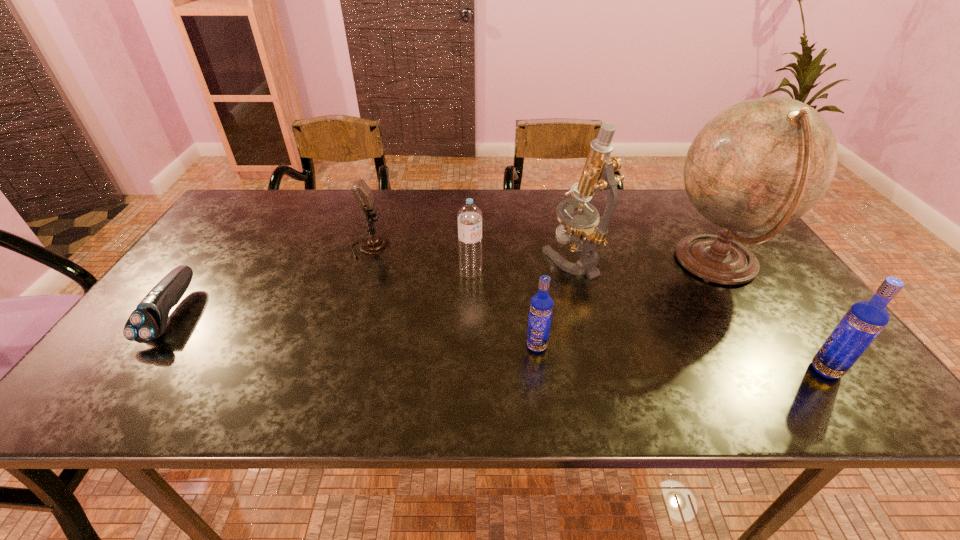
What are the coordinates of `object that is the fifth closest to the fifth object from right to left` in the screenshot? It's located at (148, 321).

Choose which object is the second nearest neighbor to the second object from left to right. Please provide its 2D coordinates. Your answer should be formatted as a tuple, i.e. [(x, y)], where the tuple contains the x and y coordinates of a point satisfying the conditions above.

[(148, 321)]

Locate an element on the screen. free location that satisfies the following two spatial constraints: 1. on the front-facing side of the sixth object from right to left; 2. on the head of the leftmost object is located at coordinates (349, 313).

Locate an element on the screen. Image resolution: width=960 pixels, height=540 pixels. vacant space that satisfies the following two spatial constraints: 1. on the front-facing side of the sixth object from right to left; 2. on the right side of the fifth object from right to left is located at coordinates (362, 273).

Find the location of `vacant region that satisfies the following two spatial constraints: 1. on the front-facing side of the globe; 2. on the back side of the taller vodka`. vacant region that satisfies the following two spatial constraints: 1. on the front-facing side of the globe; 2. on the back side of the taller vodka is located at coordinates (784, 370).

Where is `vacant space that satisfies the following two spatial constraints: 1. on the front-facing side of the globe; 2. on the right side of the nearest object`? The width and height of the screenshot is (960, 540). vacant space that satisfies the following two spatial constraints: 1. on the front-facing side of the globe; 2. on the right side of the nearest object is located at coordinates (784, 370).

Image resolution: width=960 pixels, height=540 pixels. Identify the location of free region that satisfies the following two spatial constraints: 1. on the front-facing side of the second object from left to right; 2. on the back side of the fifth object from right to left. point(362,273).

Find the location of `vacant space that satisfies the following two spatial constraints: 1. on the front-facing side of the right vodka; 2. on the left side of the globe`. vacant space that satisfies the following two spatial constraints: 1. on the front-facing side of the right vodka; 2. on the left side of the globe is located at coordinates (784, 370).

Locate an element on the screen. This screenshot has width=960, height=540. free point that satisfies the following two spatial constraints: 1. on the front-facing side of the third object from right to left; 2. on the left side of the microphone is located at coordinates (366, 259).